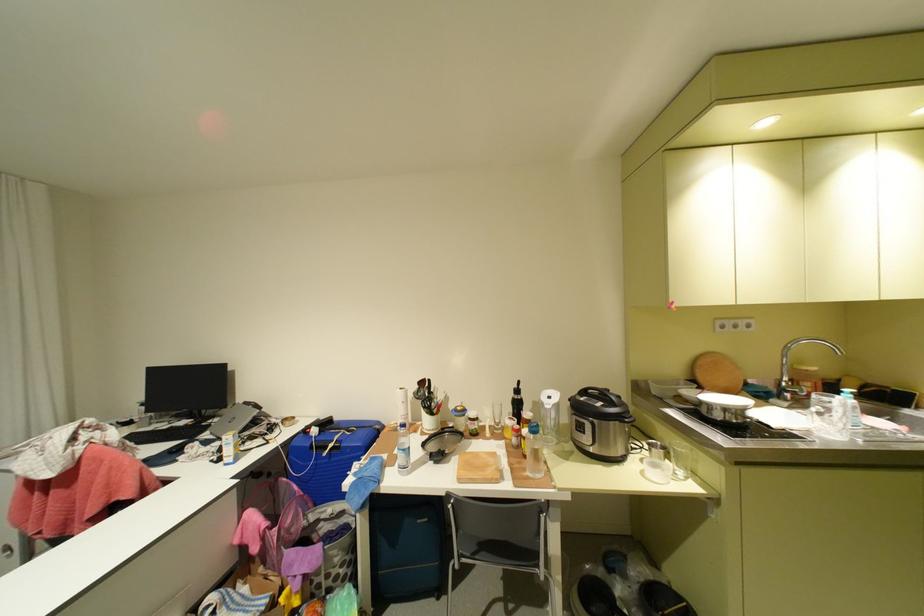
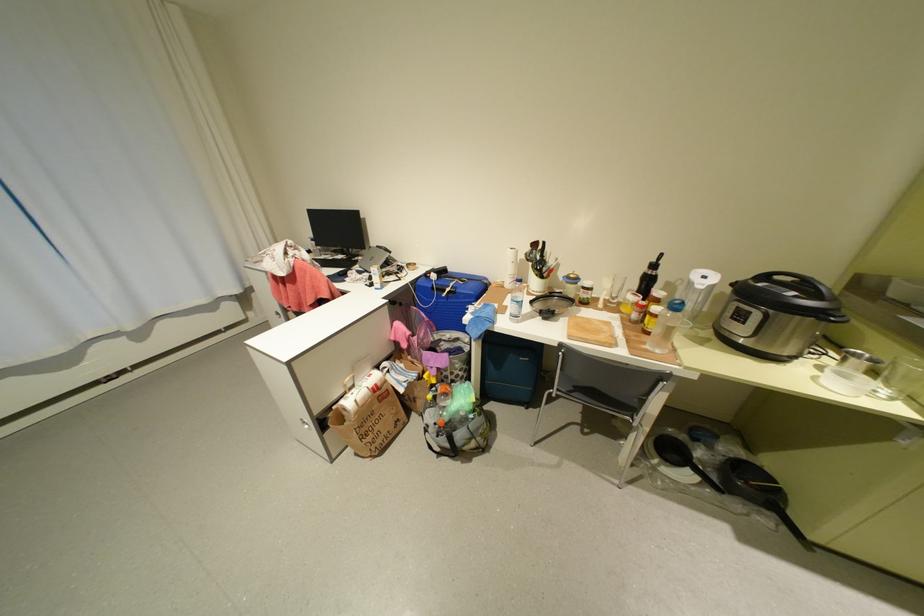
In the second image, find the point that corresponds to (638,421) in the first image.

(844, 320)